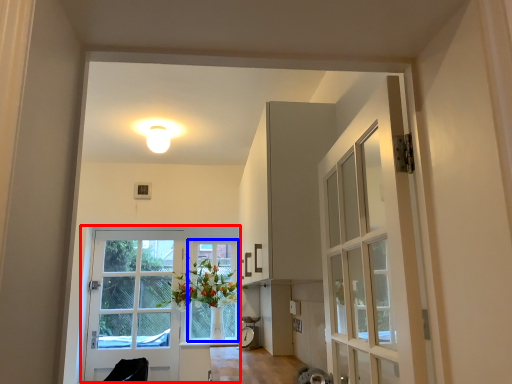
Question: Which object is closer to the camera taking this photo, door (highlighted by a red box) or window frame (highlighted by a blue box)?

Choices:
 (A) door
 (B) window frame

Answer: (A)